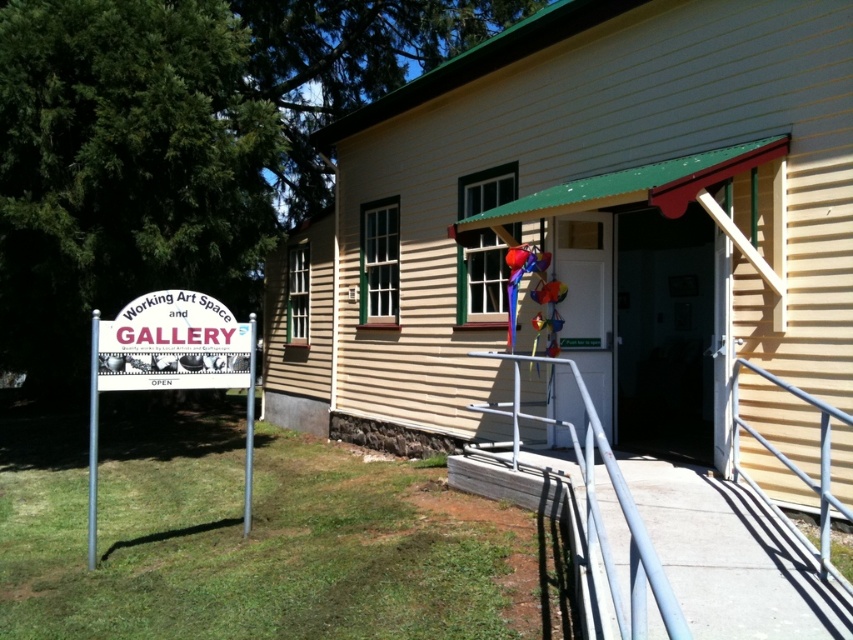
From the picture: You are a visitor approaching the entrance of the building. You see the white plastic sign at lower left and the silver metallic handrail at lower right. Which object is closer to you as you approach the entrance?

The white plastic sign at lower left is closer to you because it is further to the viewer than the silver metallic handrail at lower right, meaning it appears nearer in your line of sight.